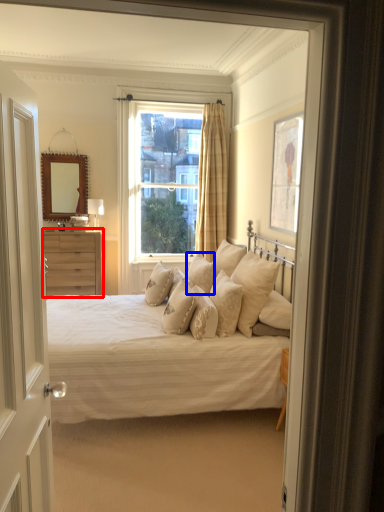
Question: Which of the following is the farthest to the observer, chest of drawers (highlighted by a red box) or pillow (highlighted by a blue box)?

Choices:
 (A) chest of drawers
 (B) pillow

Answer: (A)